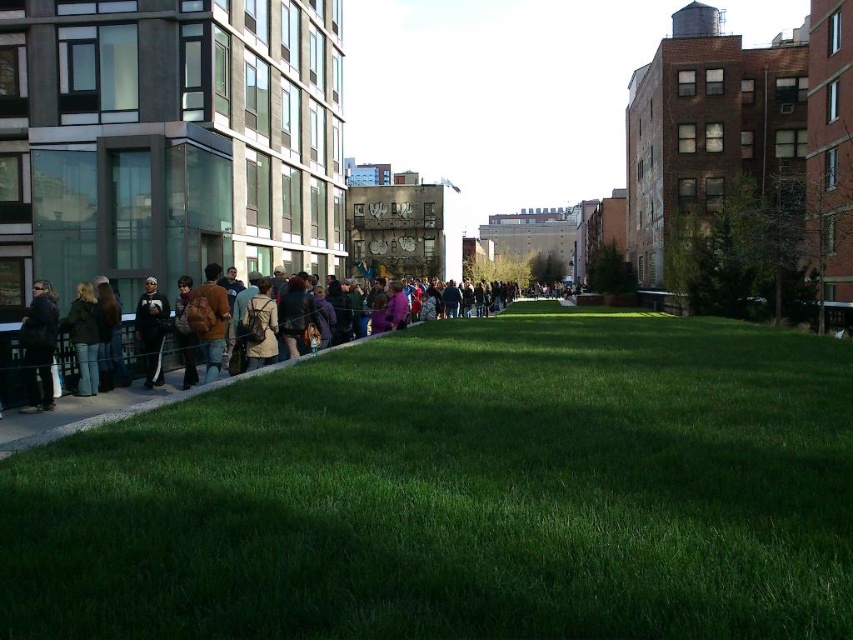
Which of these two, green grassy at center or denim jacket at left, stands shorter?

green grassy at center

Which is below, green grassy at center or denim jacket at left?

green grassy at center

What do you see at coordinates (460, 492) in the screenshot? Image resolution: width=853 pixels, height=640 pixels. I see `green grassy at center` at bounding box center [460, 492].

This screenshot has height=640, width=853. In order to click on green grassy at center in this screenshot , I will do `click(460, 492)`.

Does dark blue jacket at left have a larger size compared to denim jacket at left?

Indeed, dark blue jacket at left has a larger size compared to denim jacket at left.

Between dark blue jacket at left and denim jacket at left, which one appears on the right side from the viewer's perspective?

Positioned to the right is denim jacket at left.

Who is more forward, [42,358] or [86,388]?

Point [42,358] is in front.

Where is `dark blue jacket at left`? The height and width of the screenshot is (640, 853). dark blue jacket at left is located at coordinates (39, 346).

Is the position of dark blue jacket at left less distant than that of brown fuzzy jacket at center?

Yes.

Is point (25, 337) positioned behind point (207, 266)?

No, (25, 337) is closer to viewer.

In order to click on dark blue jacket at left in this screenshot , I will do `click(39, 346)`.